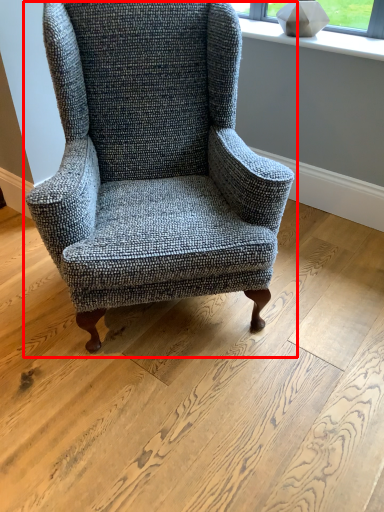
Question: Considering the relative positions of chair (annotated by the red box) and window sill in the image provided, where is chair (annotated by the red box) located with respect to the staircase?

Choices:
 (A) left
 (B) right

Answer: (A)